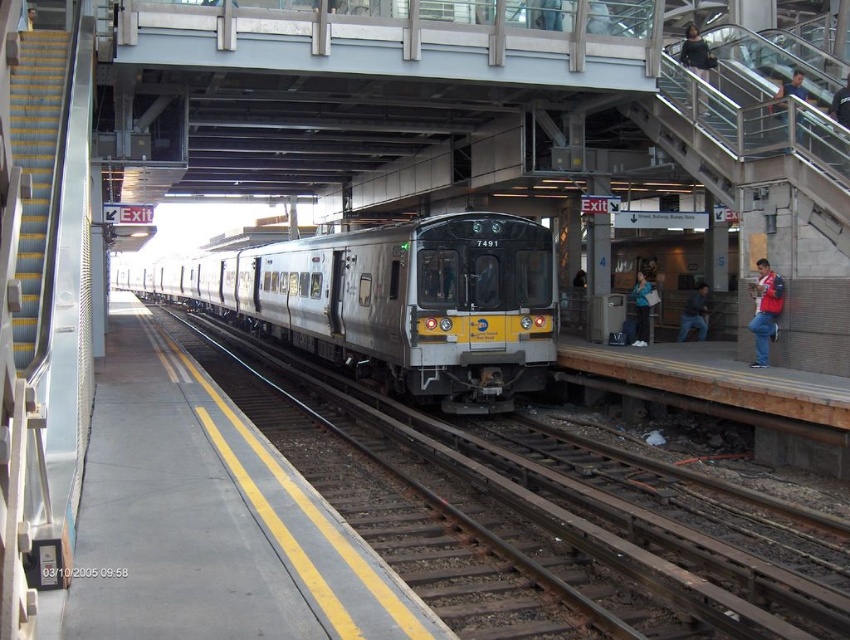
Question: Estimate the real-world distances between objects in this image. Which object is farther from the metal/smooth train track at center?

Choices:
 (A) dark gray jacket at right
 (B) denim jacket at lower right
 (C) red jacket at right
 (D) blue shirt at upper right

Answer: (D)

Question: Which point is farther to the camera?

Choices:
 (A) (693, 49)
 (B) (796, 120)
 (C) (837, 609)

Answer: (A)

Question: Based on their relative distances, which object is farther from the dark gray jacket at right?

Choices:
 (A) dark gray jacket at upper right
 (B) denim jacket at lower right

Answer: (A)

Question: Is red jacket at right to the right of denim jacket at lower right from the viewer's perspective?

Choices:
 (A) yes
 (B) no

Answer: (B)

Question: Is the position of dark gray jacket at upper right more distant than that of dark gray jacket at right?

Choices:
 (A) no
 (B) yes

Answer: (A)

Question: Is metal/smooth train track at center below blue shirt at upper right?

Choices:
 (A) yes
 (B) no

Answer: (A)